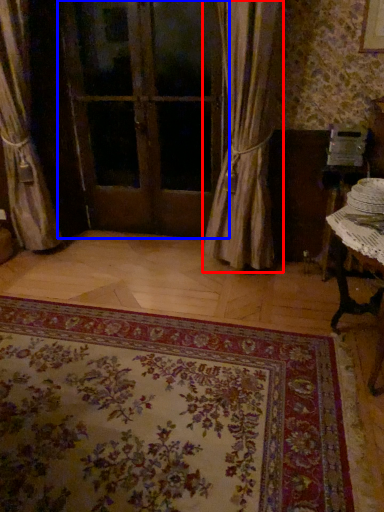
Question: Among these objects, which one is farthest to the camera, curtain (highlighted by a red box) or door (highlighted by a blue box)?

Choices:
 (A) curtain
 (B) door

Answer: (B)